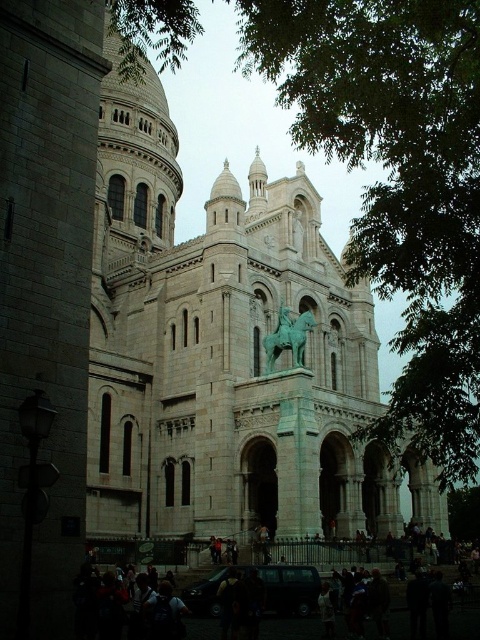
You are a tour guide explaining the cathedral and its surroundings to visitors. You mention both the green leafy tree at upper right and the green patina statue at center. How far apart are these two landmarks?

The green leafy tree at upper right and the green patina statue at center are 75.47 feet apart.

From the picture: You are a visitor standing at the entrance of the cathedral. You notice a green leafy tree at upper right and a green patina statue at center. Which object is closer to you from your current position?

The green leafy tree at upper right is closer to you because it is in front of the green patina statue at center, indicating it is nearer in the scene.